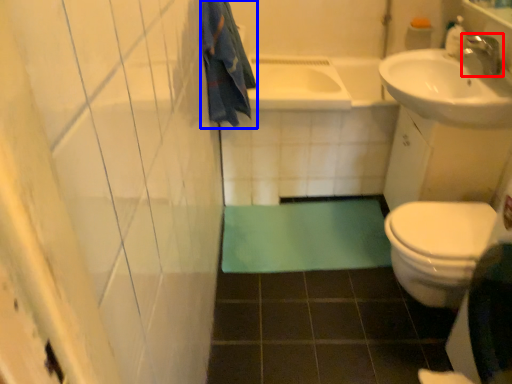
Question: Among these objects, which one is farthest to the camera, tap (highlighted by a red box) or bath towel (highlighted by a blue box)?

Choices:
 (A) tap
 (B) bath towel

Answer: (A)